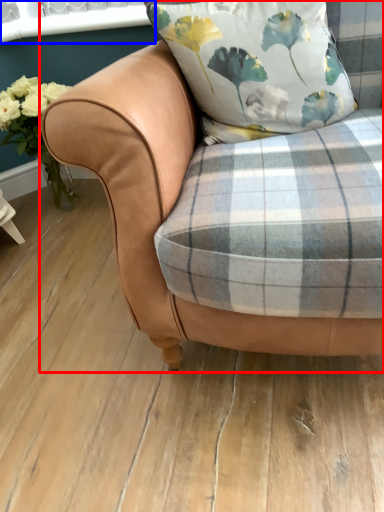
Question: Which of the following is the farthest to the observer, chair (highlighted by a red box) or window screen (highlighted by a blue box)?

Choices:
 (A) chair
 (B) window screen

Answer: (B)